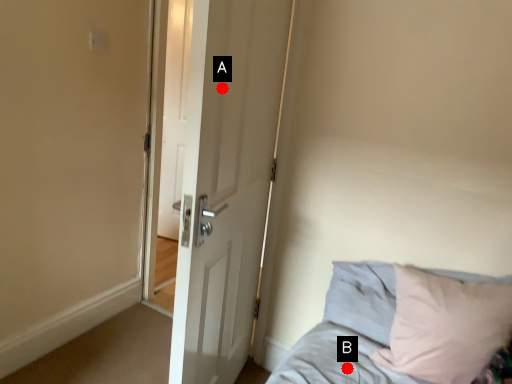
Question: Two points are circled on the image, labeled by A and B beside each circle. Which point appears farthest from the camera in this image?

Choices:
 (A) A is further
 (B) B is further

Answer: (B)